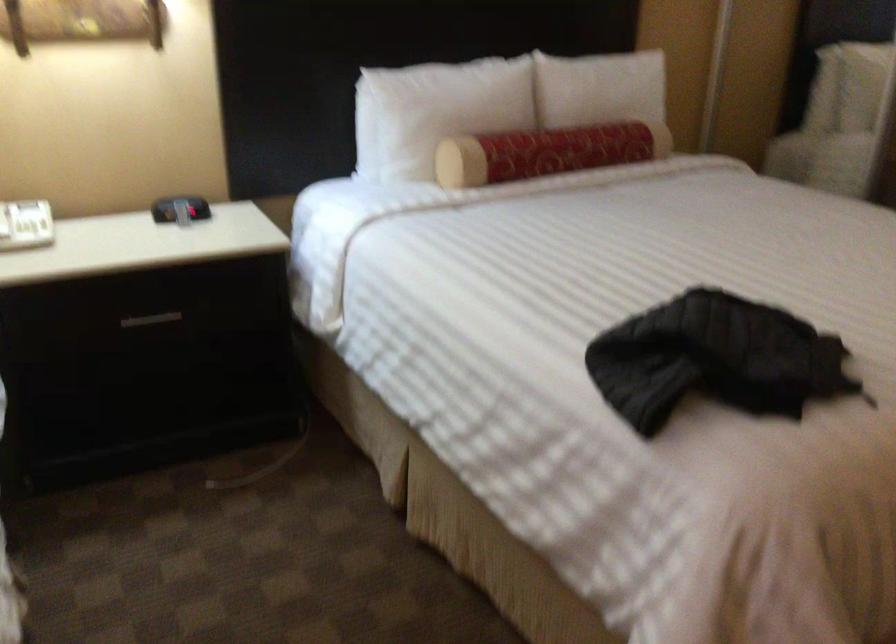
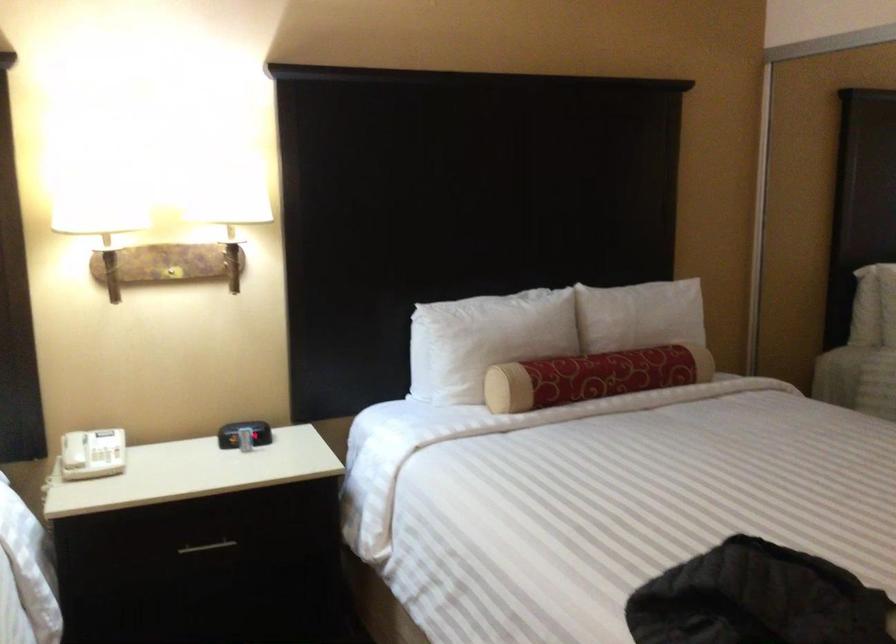
The point at [156,319] is marked in the first image. Where is the corresponding point in the second image?

(207, 547)